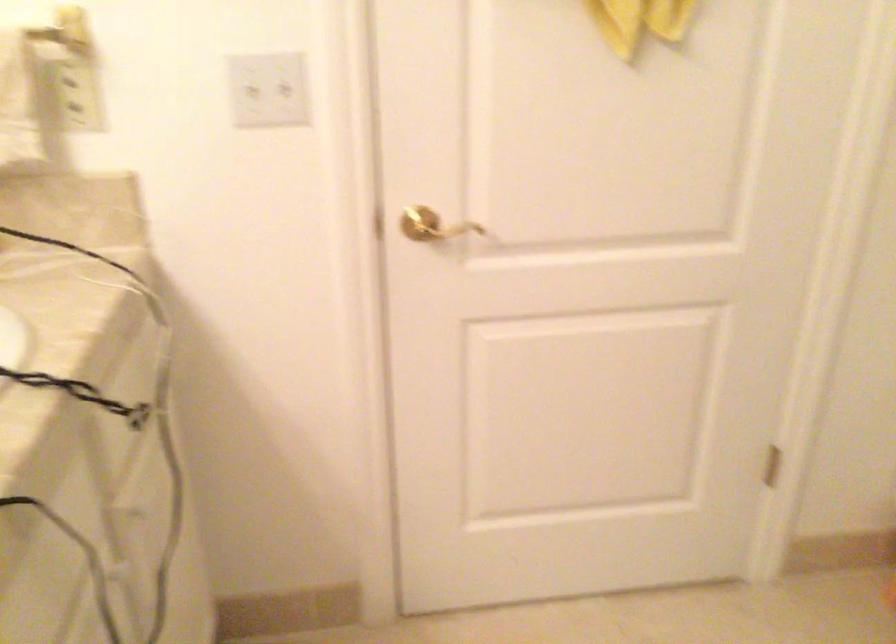
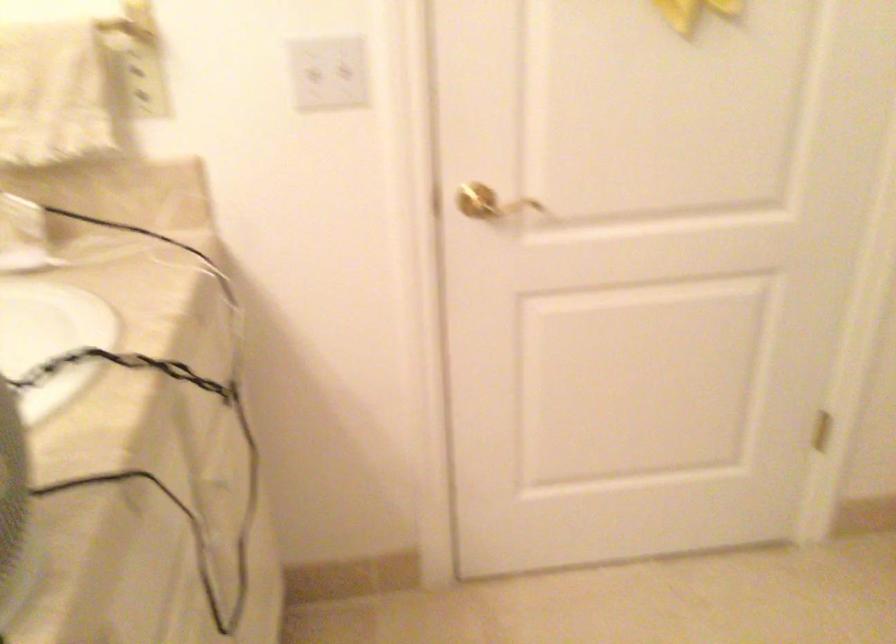
Locate, in the second image, the point that corresponds to (69,80) in the first image.

(136, 69)